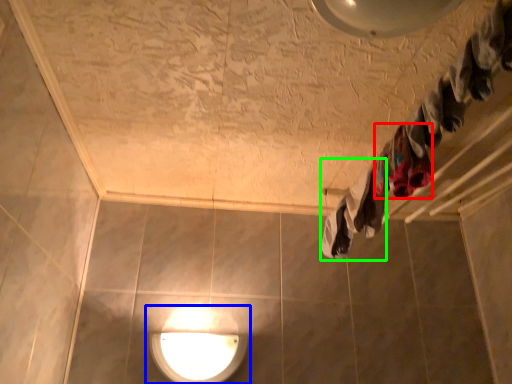
Question: Which is farther away from clothing (highlighted by a red box)? lamp (highlighted by a blue box) or clothing (highlighted by a green box)?

Choices:
 (A) lamp
 (B) clothing

Answer: (A)